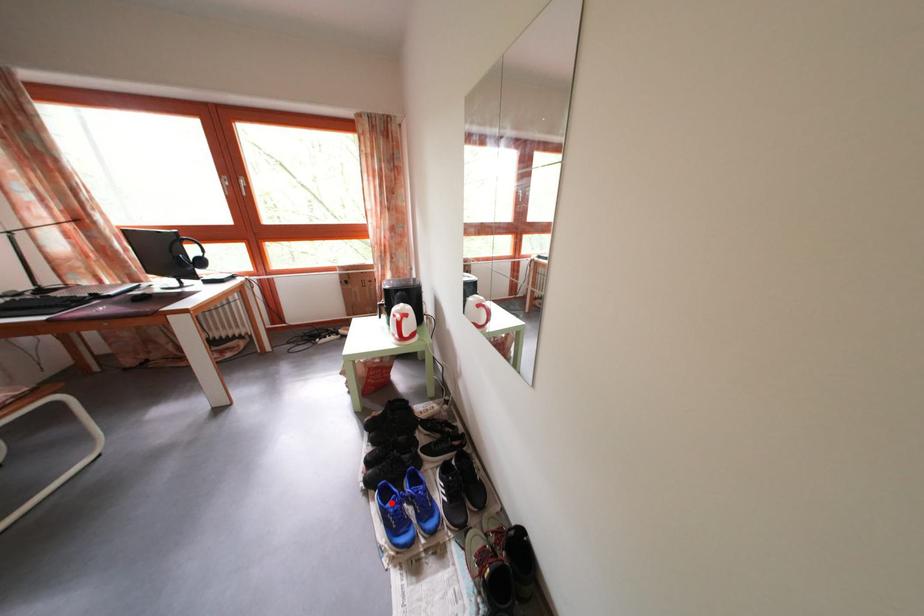
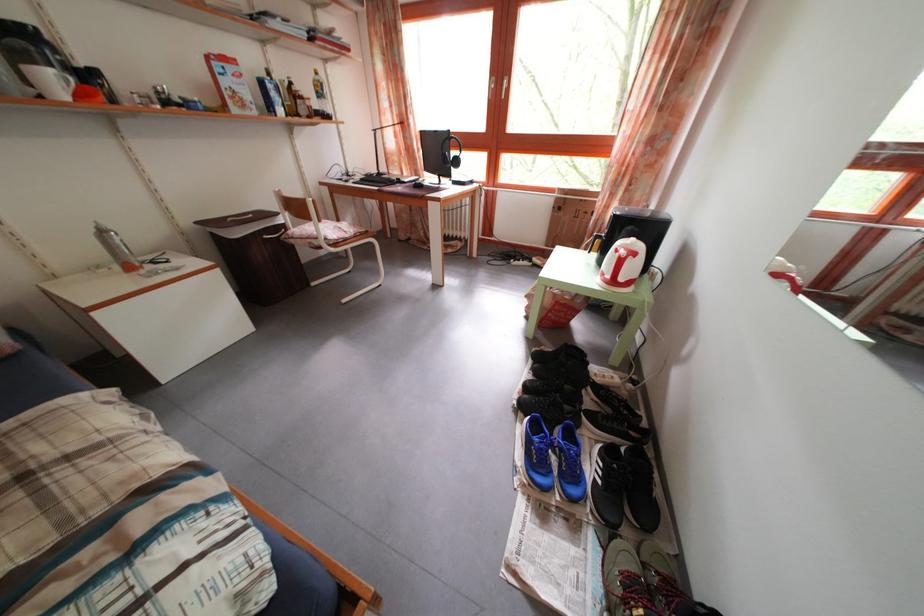
The point at the highlighted location is marked in the first image. Where is the corresponding point in the second image?

(542, 435)